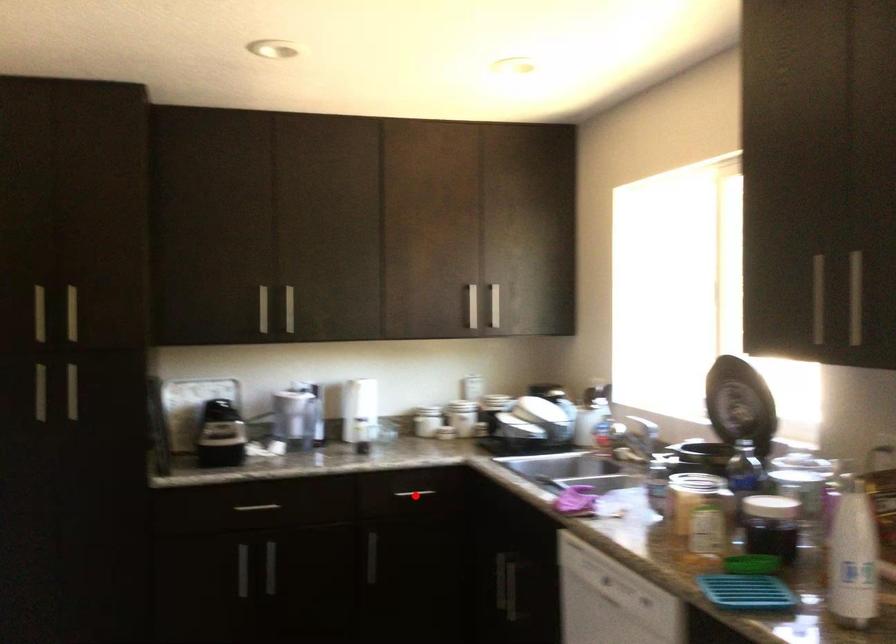
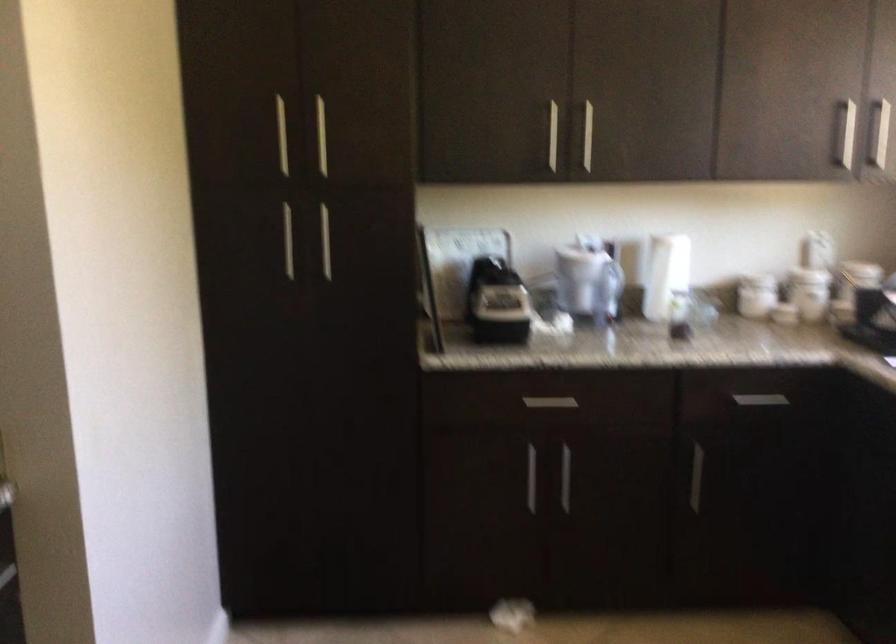
Question: I am providing you with two images of the same scene from different viewpoints. Image1 has a red point marked. In image2, the corresponding 3D location appears at what relative position? Reply with the corresponding letter.

Choices:
 (A) Closer
 (B) Farther

Answer: (A)